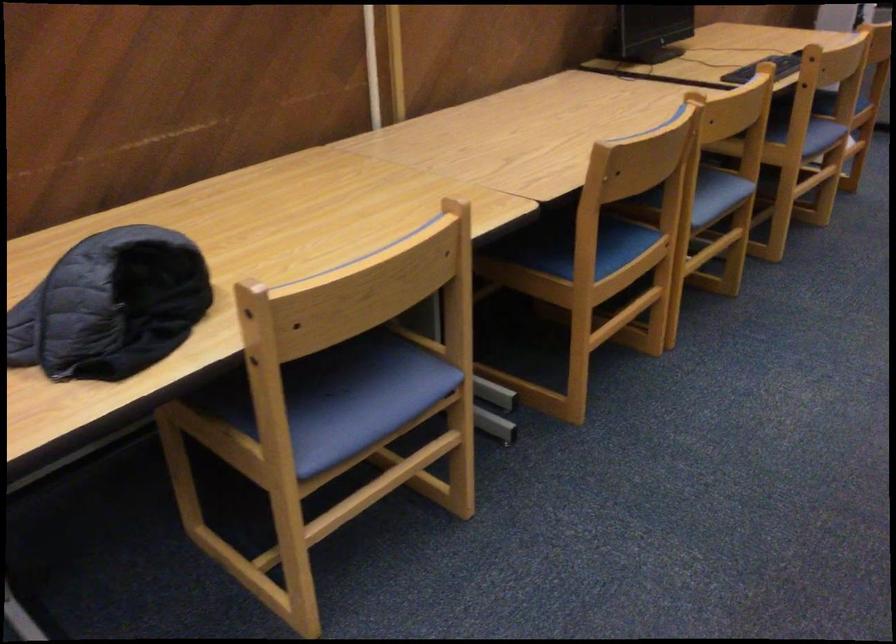
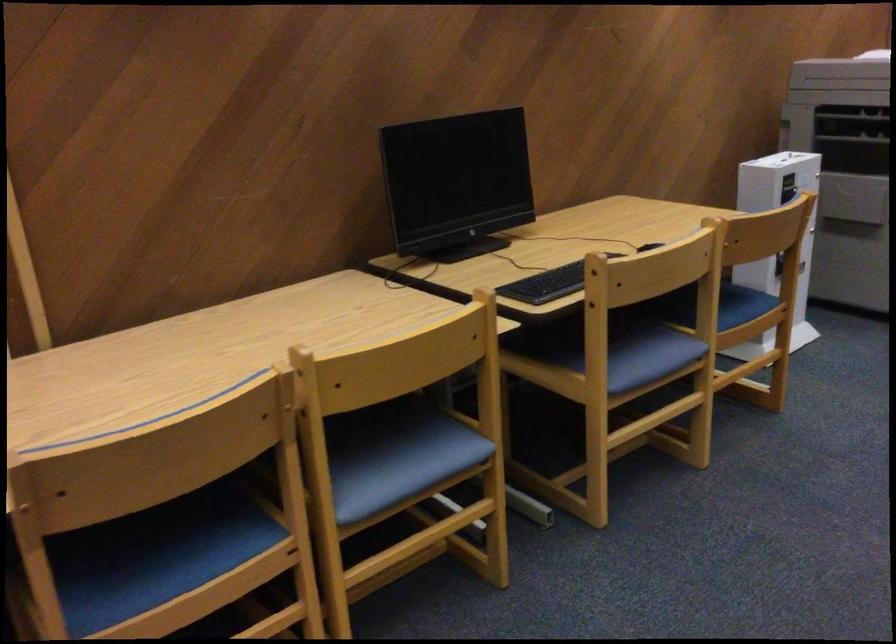
What movement of the cameraman would produce the second image?

The cameraman walked toward right, forward.